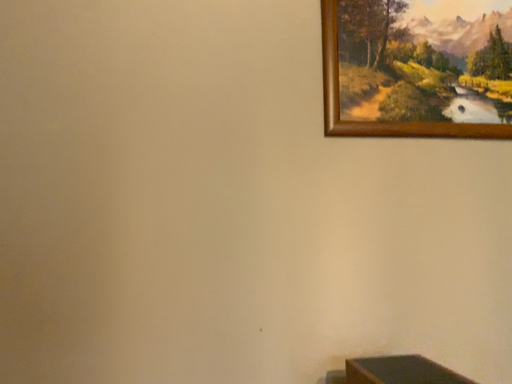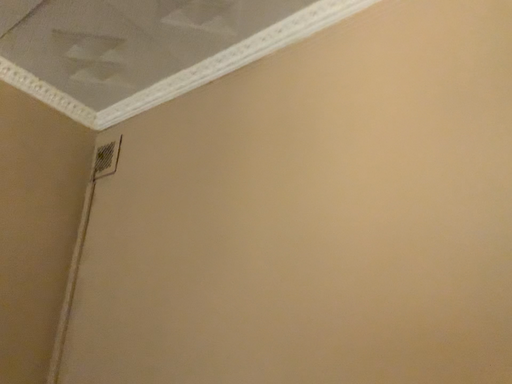
Question: Which way did the camera rotate in the video?

Choices:
 (A) rotated downward
 (B) rotated upward

Answer: (B)